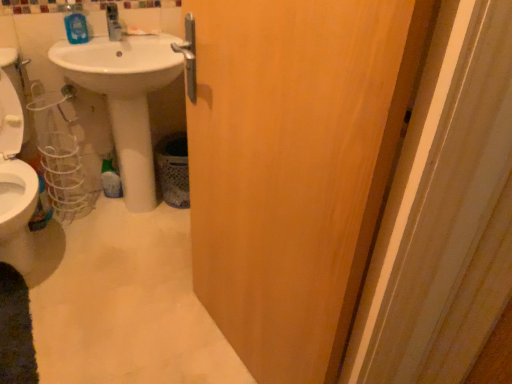
Question: From a real-world perspective, is wooden door at center over white glossy sink at center?

Choices:
 (A) no
 (B) yes

Answer: (B)

Question: Is wooden door at center at the left side of white glossy sink at center?

Choices:
 (A) no
 (B) yes

Answer: (A)

Question: Is wooden door at center taller than white glossy sink at center?

Choices:
 (A) yes
 (B) no

Answer: (A)

Question: Can you confirm if wooden door at center is shorter than white glossy sink at center?

Choices:
 (A) yes
 (B) no

Answer: (B)

Question: Is wooden door at center thinner than white glossy sink at center?

Choices:
 (A) yes
 (B) no

Answer: (A)

Question: Is wooden door at center positioned with its back to white glossy sink at center?

Choices:
 (A) yes
 (B) no

Answer: (B)

Question: Does white glossy sink at center appear on the left side of blue glossy mouthwash at upper left?

Choices:
 (A) no
 (B) yes

Answer: (A)

Question: Is white glossy sink at center at the right side of blue glossy mouthwash at upper left?

Choices:
 (A) yes
 (B) no

Answer: (A)

Question: Is white glossy sink at center aimed at blue glossy mouthwash at upper left?

Choices:
 (A) no
 (B) yes

Answer: (A)

Question: Does white glossy sink at center lie behind blue glossy mouthwash at upper left?

Choices:
 (A) no
 (B) yes

Answer: (A)

Question: Is white glossy sink at center taller than blue glossy mouthwash at upper left?

Choices:
 (A) yes
 (B) no

Answer: (A)

Question: Are white glossy sink at center and blue glossy mouthwash at upper left located far from each other?

Choices:
 (A) yes
 (B) no

Answer: (B)

Question: Is wooden door at center taller than blue glossy mouthwash at upper left?

Choices:
 (A) yes
 (B) no

Answer: (A)